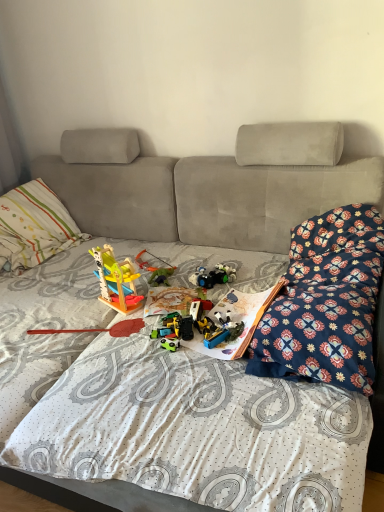
Question: Considering the relative positions of paperboard book at center and floral-patterned fabric at right in the image provided, is paperboard book at center to the right of floral-patterned fabric at right from the viewer's perspective?

Choices:
 (A) yes
 (B) no

Answer: (B)

Question: Is paperboard book at center positioned beyond the bounds of floral-patterned fabric at right?

Choices:
 (A) no
 (B) yes

Answer: (B)

Question: Can you confirm if paperboard book at center is bigger than floral-patterned fabric at right?

Choices:
 (A) no
 (B) yes

Answer: (A)

Question: Is there a large distance between paperboard book at center and floral-patterned fabric at right?

Choices:
 (A) no
 (B) yes

Answer: (A)

Question: Would you say floral-patterned fabric at right is part of paperboard book at center's contents?

Choices:
 (A) no
 (B) yes

Answer: (A)

Question: Which is correct: plastic green toy at center, marked as the 4th toy in a front-to-back arrangement, is inside multicolored plastic toy at center, the third toy when ordered from front to back, or outside of it?

Choices:
 (A) inside
 (B) outside

Answer: (B)

Question: Considering the positions of plastic green toy at center, marked as the 4th toy in a front-to-back arrangement, and multicolored plastic toy at center, marked as the 3th toy in a back-to-front arrangement, in the image, is plastic green toy at center, marked as the 4th toy in a front-to-back arrangement, taller or shorter than multicolored plastic toy at center, marked as the 3th toy in a back-to-front arrangement,?

Choices:
 (A) short
 (B) tall

Answer: (A)

Question: Considering the positions of point (152, 283) and point (193, 281), is point (152, 283) closer or farther from the camera than point (193, 281)?

Choices:
 (A) closer
 (B) farther

Answer: (B)

Question: Is plastic green toy at center, marked as the 4th toy in a front-to-back arrangement, wider or thinner than multicolored plastic toy at center, marked as the 3th toy in a back-to-front arrangement?

Choices:
 (A) wide
 (B) thin

Answer: (B)

Question: Does point (122, 333) appear closer or farther from the camera than point (155, 269)?

Choices:
 (A) closer
 (B) farther

Answer: (A)

Question: From the image's perspective, is wooden toy at center positioned above or below plastic green toy at center, which is counted as the second toy, starting from the back?

Choices:
 (A) below
 (B) above

Answer: (A)

Question: Based on their sizes in the image, would you say wooden toy at center is bigger or smaller than plastic green toy at center, marked as the 4th toy in a front-to-back arrangement?

Choices:
 (A) small
 (B) big

Answer: (B)

Question: From a real-world perspective, relative to plastic green toy at center, marked as the 4th toy in a front-to-back arrangement, is wooden toy at center vertically above or below?

Choices:
 (A) above
 (B) below

Answer: (B)

Question: In terms of width, does striped cotton pillow at left look wider or thinner when compared to floral-patterned fabric at right?

Choices:
 (A) thin
 (B) wide

Answer: (A)

Question: Is point (79, 233) positioned closer to the camera than point (331, 234)?

Choices:
 (A) closer
 (B) farther

Answer: (B)